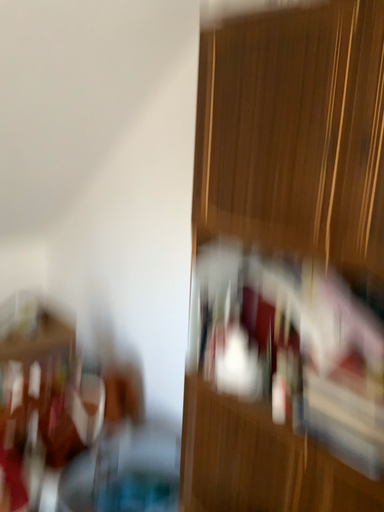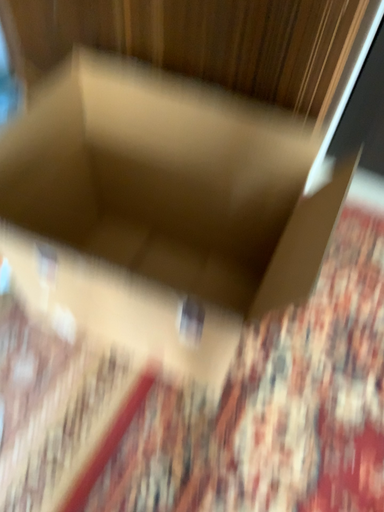
Question: How did the camera likely rotate when shooting the video?

Choices:
 (A) rotated right
 (B) rotated left

Answer: (A)